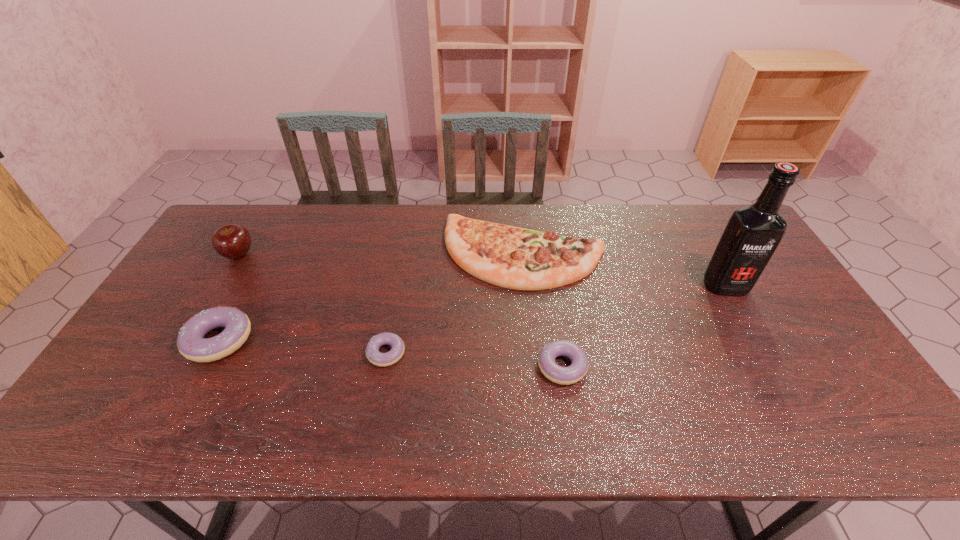
You are a GUI agent. You are given a task and a screenshot of the screen. Output one action in this format:
    pyautogui.click(x=<x>, y=<y>)
    Task: Click on the free space located on the left of the second doughnut from right to left
    The width and height of the screenshot is (960, 540).
    Given the screenshot: What is the action you would take?
    pyautogui.click(x=221, y=353)

The width and height of the screenshot is (960, 540). Find the location of `vacant space situated 0.140m on the back of the rightmost doughnut`. vacant space situated 0.140m on the back of the rightmost doughnut is located at coordinates (553, 307).

Locate an element on the screen. The height and width of the screenshot is (540, 960). free point located 0.080m on the left of the pizza is located at coordinates (419, 253).

Identify the location of vacant area located 0.260m on the front-facing side of the rightmost object. This screenshot has width=960, height=540. (776, 372).

Where is `free region located 0.130m on the front of the apple`? The image size is (960, 540). free region located 0.130m on the front of the apple is located at coordinates (213, 296).

Image resolution: width=960 pixels, height=540 pixels. Identify the location of pizza located at the far edge. (516, 258).

Find the location of a particular element. Image resolution: width=960 pixels, height=540 pixels. apple present at the far edge is located at coordinates (232, 241).

Locate an element on the screen. The width and height of the screenshot is (960, 540). object that is at the near edge is located at coordinates (577, 370).

I want to click on doughnut that is at the left edge, so click(x=191, y=343).

Find the location of a particular element. apple that is positioned at the left edge is located at coordinates (232, 241).